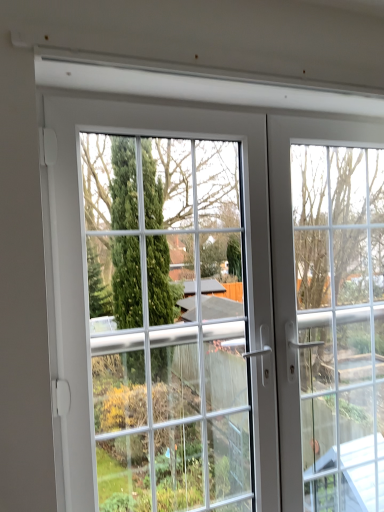
Question: In terms of width, does white plastic window frame at right look wider or thinner when compared to white glass door at center?

Choices:
 (A) thin
 (B) wide

Answer: (A)

Question: Relative to white glass door at center, is white plastic window frame at right in front or behind?

Choices:
 (A) behind
 (B) front

Answer: (A)

Question: From a real-world perspective, is white plastic window frame at right physically located above or below white glass door at center?

Choices:
 (A) below
 (B) above

Answer: (A)

Question: Is white glass door at center in front of or behind white plastic window frame at right in the image?

Choices:
 (A) behind
 (B) front

Answer: (B)

Question: In terms of height, does white glass door at center look taller or shorter compared to white plastic window frame at right?

Choices:
 (A) tall
 (B) short

Answer: (A)

Question: Would you say white glass door at center is inside or outside white plastic window frame at right?

Choices:
 (A) outside
 (B) inside

Answer: (A)

Question: From the image's perspective, is white glass door at center located above or below white plastic window frame at right?

Choices:
 (A) below
 (B) above

Answer: (B)